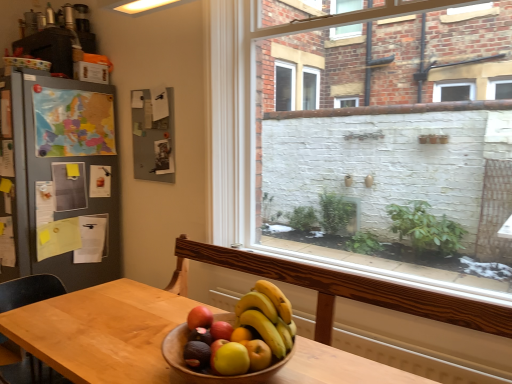
Question: From the image's perspective, is matte black cabinet at upper left located above or below wooden table at center?

Choices:
 (A) below
 (B) above

Answer: (B)

Question: In terms of size, does matte black cabinet at upper left appear bigger or smaller than wooden table at center?

Choices:
 (A) small
 (B) big

Answer: (A)

Question: Which is nearer to the wooden table at center?

Choices:
 (A) white brick wall at center
 (B) yellow matte bananas at center
 (C) matte black cabinet at upper left
 (D) red matte apple at center
 (E) wooden bowl at center

Answer: (E)

Question: Which object is the farthest from the wooden table at center?

Choices:
 (A) red matte apple at center
 (B) white brick wall at center
 (C) wooden bowl at center
 (D) matte black cabinet at upper left
 (E) yellow matte bananas at center

Answer: (D)